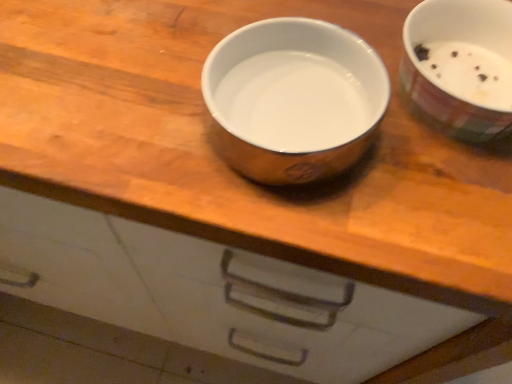
Where is `free space on the front side of white glossy bowl at upper right, which appears as the first tableware when viewed from the right`? This screenshot has width=512, height=384. free space on the front side of white glossy bowl at upper right, which appears as the first tableware when viewed from the right is located at coordinates [430, 216].